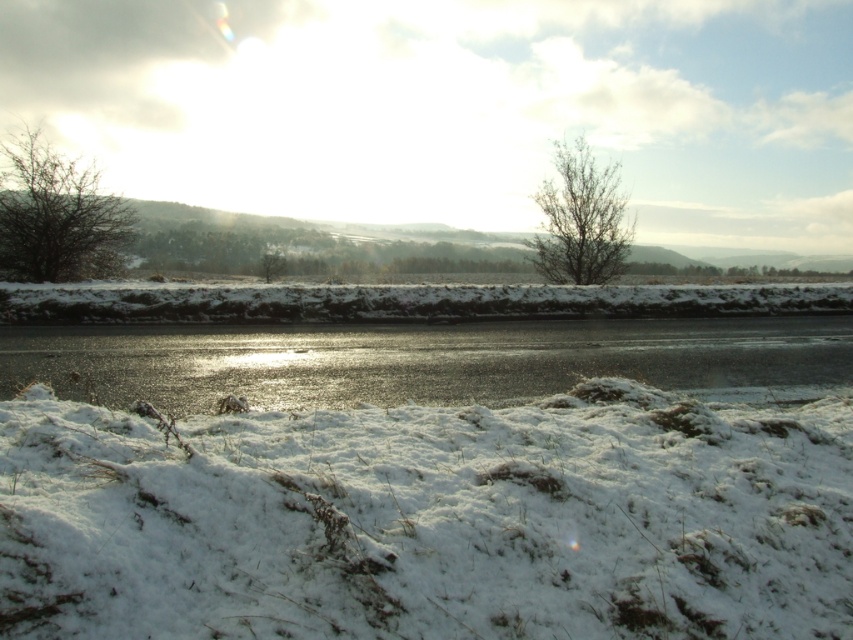
Question: Does white fluffy snow at lower left appear over bare branches at upper center?

Choices:
 (A) no
 (B) yes

Answer: (A)

Question: Considering the real-world distances, which object is farthest from the bare branches at upper center?

Choices:
 (A) bare branches at left
 (B) white fluffy snow at lower left
 (C) glistening ice at center

Answer: (B)

Question: Considering the relative positions of bare branches at left and bare branches at upper center in the image provided, where is bare branches at left located with respect to bare branches at upper center?

Choices:
 (A) left
 (B) right

Answer: (A)

Question: Which point is closer to the camera?

Choices:
 (A) (160, 525)
 (B) (341, 376)
 (C) (109, 273)
 (D) (590, 173)

Answer: (A)

Question: Which of the following is the farthest from the observer?

Choices:
 (A) bare branches at left
 (B) white fluffy snow at lower left
 (C) glistening ice at center

Answer: (A)

Question: Is white fluffy snow at lower left below bare branches at left?

Choices:
 (A) no
 (B) yes

Answer: (B)